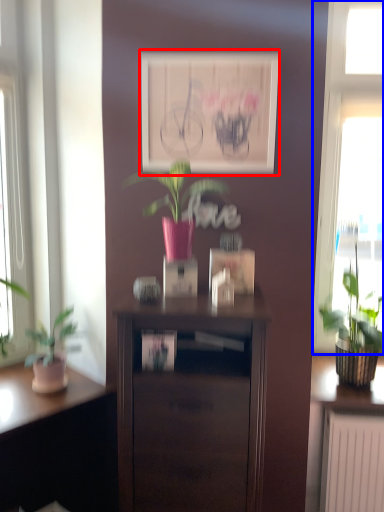
Question: Which object is further to the camera taking this photo, picture frame (highlighted by a red box) or window (highlighted by a blue box)?

Choices:
 (A) picture frame
 (B) window

Answer: (B)